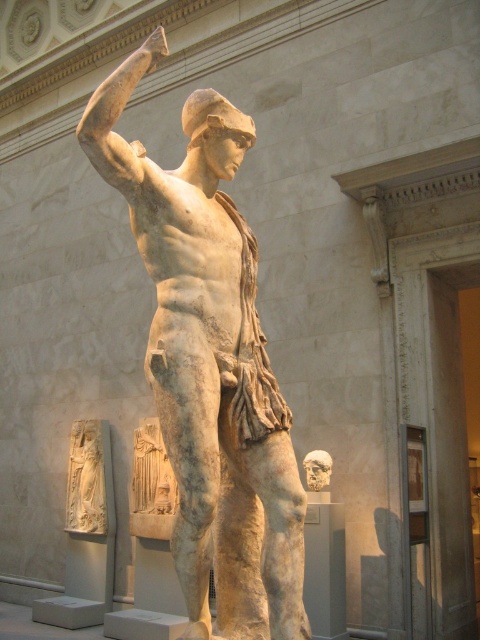
Question: Is white marble statue at center above matte stone head at center?

Choices:
 (A) yes
 (B) no

Answer: (A)

Question: Which point appears farthest from the camera in this image?

Choices:
 (A) (275, 408)
 (B) (308, 481)

Answer: (B)

Question: Which point is closer to the camera?

Choices:
 (A) matte stone head at center
 (B) white marble relief at lower left
 (C) white marble statue at center

Answer: (C)

Question: Can you confirm if white marble relief at lower left is positioned above matte stone head at center?

Choices:
 (A) no
 (B) yes

Answer: (A)

Question: Can you confirm if white marble statue at center is positioned above white marble relief at lower left?

Choices:
 (A) yes
 (B) no

Answer: (A)

Question: Which object is positioned closest to the white marble relief at lower left?

Choices:
 (A) matte stone head at center
 (B) white marble statue at center

Answer: (A)